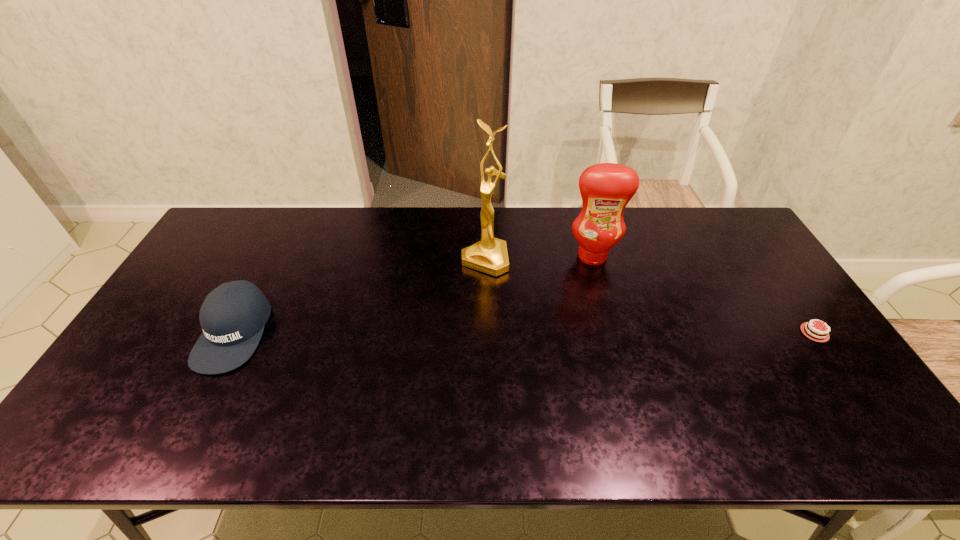
At what (x,y) coordinates should I click in order to perform the action: click on free space on the desktop that is between the leftmost object and the chocolate cake and is positioned on the label side of the condiment. Please return your answer as a coordinate pair (x, y). Image resolution: width=960 pixels, height=540 pixels. Looking at the image, I should click on (600, 333).

Identify the location of vacant space on the desktop that is between the leftmost object and the rightmost object and is positioned on the front-facing side of the third object from right to left. This screenshot has width=960, height=540. (441, 332).